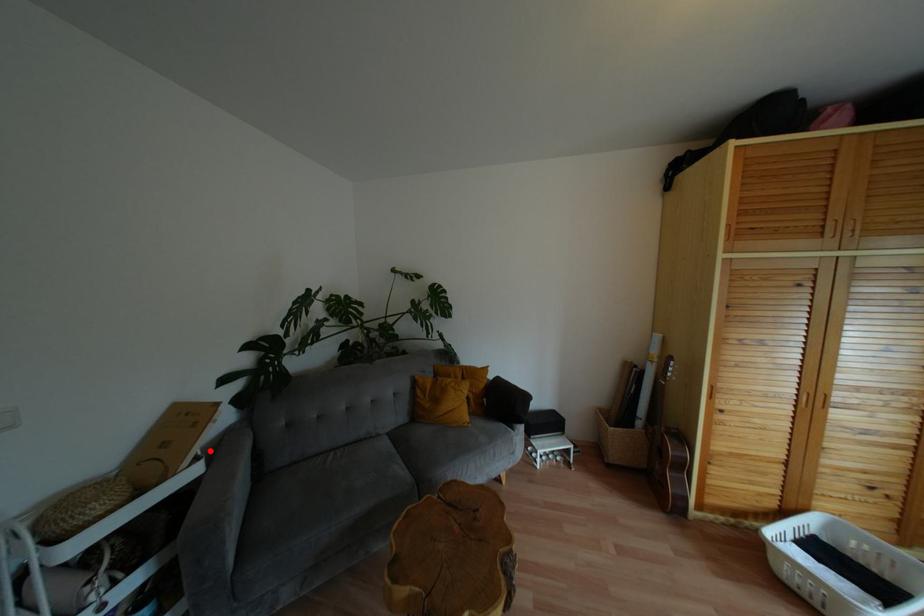
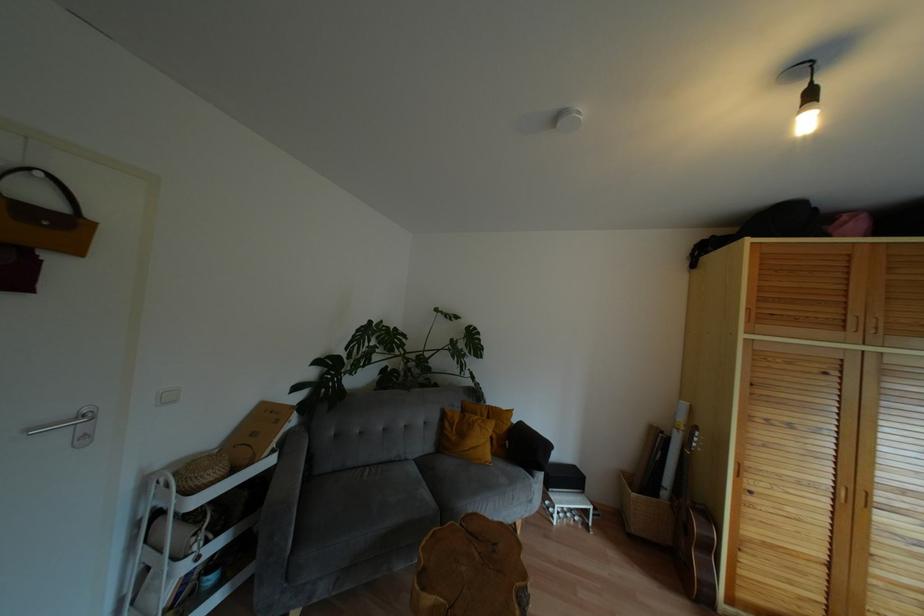
Question: I am providing you with two images of the same scene from different viewpoints. A red point is marked on the first image. At the location where the point appears in image 1, is it still visible in image 2?

Choices:
 (A) Yes
 (B) No

Answer: (A)